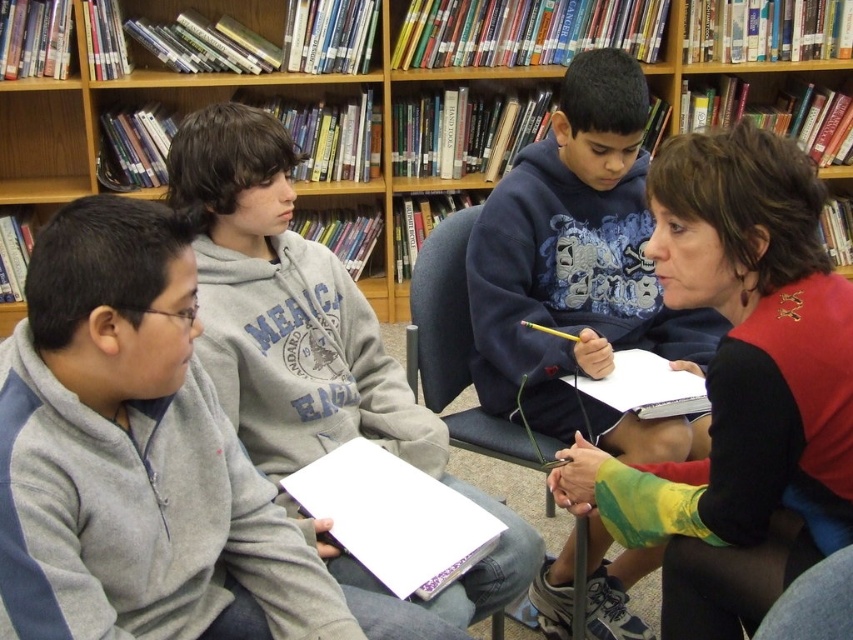
Can you confirm if gray fleece hoodie at left is taller than gray fleece hoodie at center?

Incorrect, gray fleece hoodie at left's height is not larger of gray fleece hoodie at center's.

The image size is (853, 640). What are the coordinates of `gray fleece hoodie at left` in the screenshot? It's located at (132, 452).

Does gray fleece hoodie at center have a greater height compared to blue fabric chair at lower right?

Correct, gray fleece hoodie at center is much taller as blue fabric chair at lower right.

Between gray fleece hoodie at center and blue fabric chair at lower right, which one appears on the right side from the viewer's perspective?

blue fabric chair at lower right is more to the right.

Describe the element at coordinates (308, 337) in the screenshot. I see `gray fleece hoodie at center` at that location.

This screenshot has height=640, width=853. I want to click on gray fleece hoodie at center, so click(x=308, y=337).

Does point (247, 314) come farther from viewer compared to point (320, 182)?

No, (247, 314) is closer to viewer.

Does gray fleece hoodie at center lie in front of wooden bookcase at upper center?

Yes, gray fleece hoodie at center is in front of wooden bookcase at upper center.

Is point (350, 392) farther from camera compared to point (456, 68)?

No.

You are a GUI agent. You are given a task and a screenshot of the screen. Output one action in this format:
    pyautogui.click(x=<x>, y=<y>)
    Task: Click on the gray fleece hoodie at center
    
    Given the screenshot: What is the action you would take?
    click(308, 337)